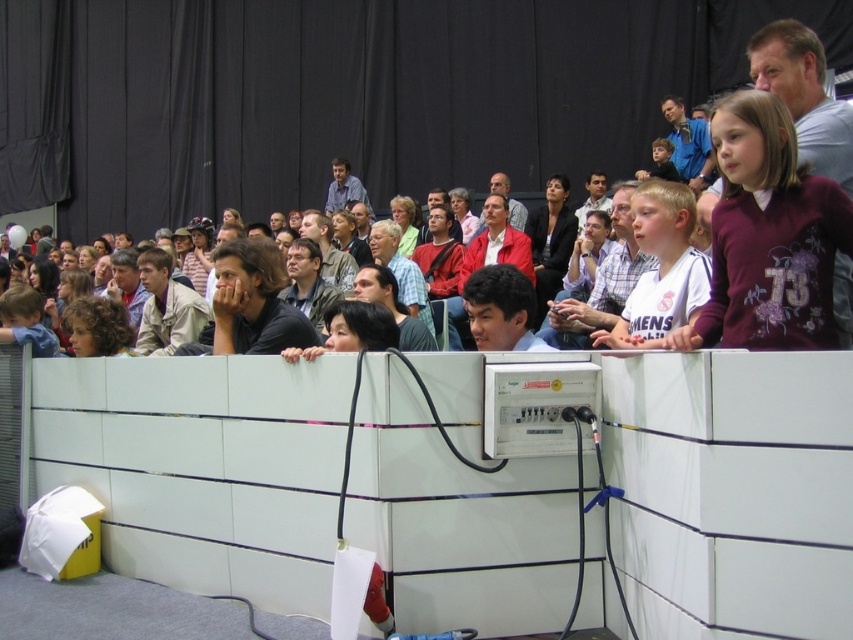
Looking at this image, who is more distant from viewer, (334, 180) or (595, 176)?

The point (334, 180) is more distant.

Which is below, matte blue shirt at center or matte black jacket at upper center?

Positioned lower is matte black jacket at upper center.

Who is more distant from viewer, (347, 195) or (596, 209)?

The point (347, 195) is more distant.

At what (x,y) coordinates should I click in order to perform the action: click on matte blue shirt at center. Please return your answer as a coordinate pair (x, y). Looking at the image, I should click on (343, 188).

Between khaki fabric jacket at left and matte blue shirt at center, which one has more height?

matte blue shirt at center is taller.

Between point (144, 320) and point (339, 180), which one is positioned behind?

Positioned behind is point (339, 180).

Between point (181, 284) and point (357, 200), which one is positioned in front?

Point (181, 284)

This screenshot has height=640, width=853. In order to click on khaki fabric jacket at left in this screenshot , I will do `click(166, 307)`.

Is point (386, 243) positioned before point (320, 218)?

Yes, it is in front of point (320, 218).

Is light brown hair at center below matte gray shirt at center?

Yes.

Is point (410, 300) positioned after point (347, 285)?

No, it is not.

At what (x,y) coordinates should I click in order to perform the action: click on light brown hair at center. Please return your answer as a coordinate pair (x, y). This screenshot has height=640, width=853. Looking at the image, I should click on (401, 269).